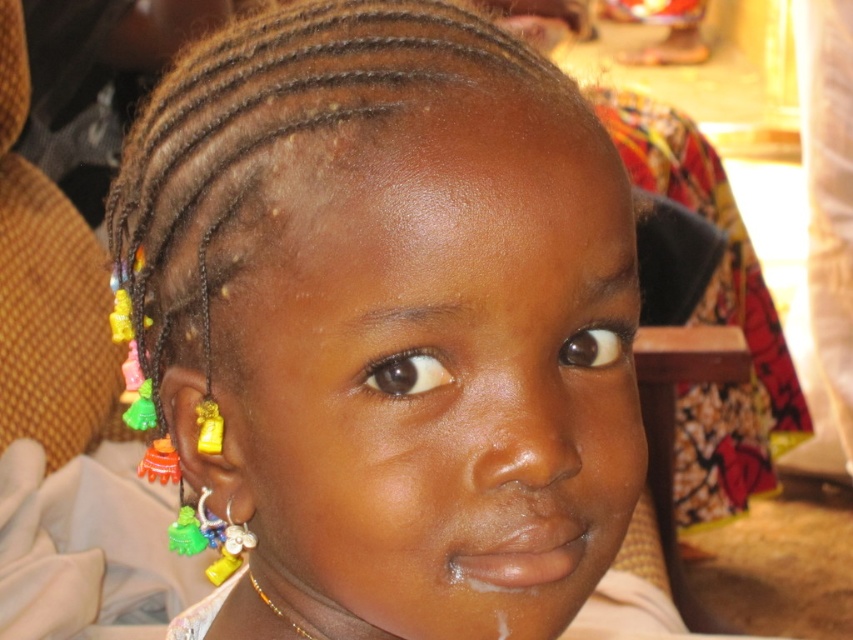
From the picture: You are holding a toy that needs to be placed exactly at the point marked at coordinates point (480, 486). If you are standing 12 inches away from the camera, will you be able to reach the point without moving closer?

The distance of point (480, 486) from camera is 11.89 inches, so if you are standing 12 inches away from the camera, you are slightly farther than the point. You can reach it without moving closer since 12 inches is just a bit more than 11.89 inches.

You are a photographer taking a portrait of the child and want to ensure the multicolored beaded earrings at center are in focus. If your camera has a depth of field that can sharply capture objects within 10 inches from the current focus point, should you adjust the focus closer or farther away from the child?

The multicolored beaded earrings at center are 11.06 inches away from the viewer. Since the camera can only sharply capture objects within 10 inches from the focus point, you need to adjust the focus closer to the child to ensure the earrings are within the 10 inch range.

You are a photographer trying to capture a closeup of the child. The camera can only focus on objects within 10 centimeters of each other. Are the multicolored beaded earrings at center and the gold beaded necklace at lower center within the camera focus range?

The multicolored beaded earrings at center is 12.73 centimeters away from the gold beaded necklace at lower center. Since the camera requires objects to be within 10 centimeters of each other for focus, they are outside the focus range and cannot be both in focus simultaneously.